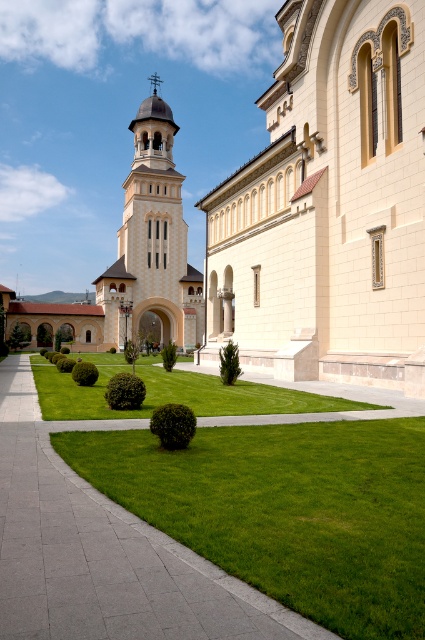
Question: Is beige stone church at center further to the viewer compared to beige stone tower at center?

Choices:
 (A) no
 (B) yes

Answer: (A)

Question: Is beige stone church at center bigger than green lawn at lower center?

Choices:
 (A) yes
 (B) no

Answer: (A)

Question: Among these points, which one is nearest to the camera?

Choices:
 (A) click(295, 550)
 (B) click(204, 385)
 (C) click(394, 20)
 (D) click(144, 310)

Answer: (A)

Question: Among these objects, which one is nearest to the camera?

Choices:
 (A) beige stone tower at center
 (B) green lawn at lower center
 (C) green lawn at center
 (D) beige stone church at center

Answer: (B)

Question: Where is beige stone tower at center located in relation to green lawn at center in the image?

Choices:
 (A) above
 (B) below

Answer: (A)

Question: Among these objects, which one is nearest to the camera?

Choices:
 (A) green lawn at lower center
 (B) beige stone church at center
 (C) green lawn at center
 (D) beige stone tower at center

Answer: (A)